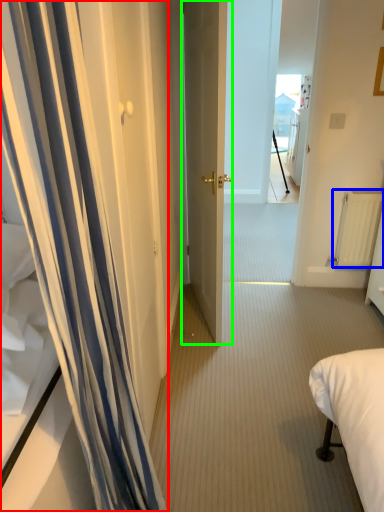
Question: Estimate the real-world distances between objects in this image. Which object is closer to curtain (highlighted by a red box), radiator (highlighted by a blue box) or door (highlighted by a green box)?

Choices:
 (A) radiator
 (B) door

Answer: (B)